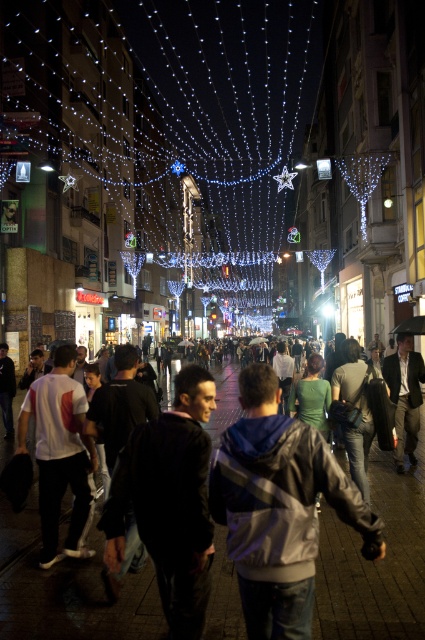
You are a photographer standing on the lively urban street scene at night. You want to capture a photo of the illuminated string lights at center without the dark clothing crowd at center appearing in the foreground. Is this possible with your current position?

The illuminated string lights at center are located above the dark clothing crowd at center, so yes, you can angle your camera upwards to capture the lights without the crowd blocking the foreground.

You are standing on the street and want to locate the illuminated string lights at center. According to the coordinates provided, where exactly would you look?

The illuminated string lights at center are located at coordinates point (150, 156).